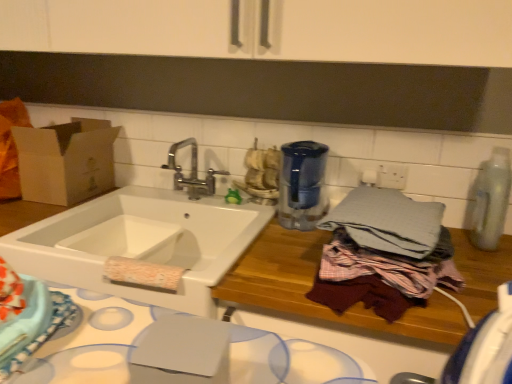
Question: Is the position of blue glass water filter at center, the 1th appliance when ordered from left to right, less distant than that of gray cotton bath towel at right?

Choices:
 (A) no
 (B) yes

Answer: (A)

Question: Is blue glass water filter at center, the 1th appliance when ordered from left to right, behind gray cotton bath towel at right?

Choices:
 (A) yes
 (B) no

Answer: (A)

Question: Can you confirm if blue glass water filter at center, acting as the second appliance starting from the right, is bigger than gray cotton bath towel at right?

Choices:
 (A) no
 (B) yes

Answer: (B)

Question: From a real-world perspective, is blue glass water filter at center, acting as the second appliance starting from the right, beneath gray cotton bath towel at right?

Choices:
 (A) yes
 (B) no

Answer: (A)

Question: Can gray cotton bath towel at right be found inside blue glass water filter at center, the 1th appliance when ordered from left to right?

Choices:
 (A) yes
 (B) no

Answer: (B)

Question: Is blue glass water filter at center, the 1th appliance when ordered from left to right, shorter than gray cotton bath towel at right?

Choices:
 (A) no
 (B) yes

Answer: (A)

Question: Can you confirm if blue glass water filter at center, acting as the second appliance starting from the right, is shorter than blue fabric cloth at lower left?

Choices:
 (A) no
 (B) yes

Answer: (A)

Question: From the image's perspective, does blue glass water filter at center, acting as the second appliance starting from the right, appear higher than blue fabric cloth at lower left?

Choices:
 (A) yes
 (B) no

Answer: (A)

Question: Is blue glass water filter at center, acting as the second appliance starting from the right, facing towards blue fabric cloth at lower left?

Choices:
 (A) no
 (B) yes

Answer: (A)

Question: Is blue fabric cloth at lower left inside blue glass water filter at center, the 1th appliance when ordered from left to right?

Choices:
 (A) yes
 (B) no

Answer: (B)

Question: Considering the relative sizes of blue glass water filter at center, the 1th appliance when ordered from left to right, and blue fabric cloth at lower left in the image provided, is blue glass water filter at center, the 1th appliance when ordered from left to right, thinner than blue fabric cloth at lower left?

Choices:
 (A) yes
 (B) no

Answer: (B)

Question: From the image's perspective, does blue glass water filter at center, acting as the second appliance starting from the right, appear lower than blue fabric cloth at lower left?

Choices:
 (A) no
 (B) yes

Answer: (A)

Question: Can you confirm if brown cardboard box at left is bigger than clear plastic bottle at right, the 1th appliance viewed from the right?

Choices:
 (A) yes
 (B) no

Answer: (A)